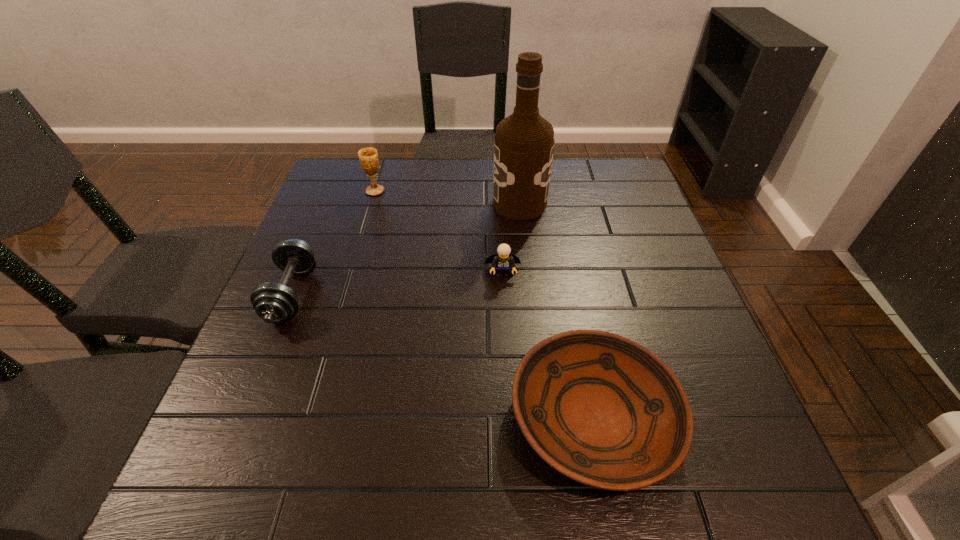
Locate an element on the screen. alcohol is located at coordinates (524, 142).

Identify the location of the fourth object from right to left. (368, 157).

The width and height of the screenshot is (960, 540). In order to click on chalice in this screenshot , I will do `click(368, 157)`.

Identify the location of dumbbell. Image resolution: width=960 pixels, height=540 pixels. (273, 302).

The width and height of the screenshot is (960, 540). Identify the location of Lego. (503, 261).

What are the coordinates of `plate` in the screenshot? It's located at (604, 411).

This screenshot has height=540, width=960. Find the location of `the shortest object`. the shortest object is located at coordinates (604, 411).

This screenshot has width=960, height=540. In order to click on free space located on the label of the alcohol in this screenshot , I will do `click(355, 204)`.

Where is `free spot located 0.350m on the label of the alcohol`? The image size is (960, 540). free spot located 0.350m on the label of the alcohol is located at coordinates (367, 204).

The image size is (960, 540). In order to click on vacant space located on the label of the alcohol in this screenshot , I will do `click(373, 204)`.